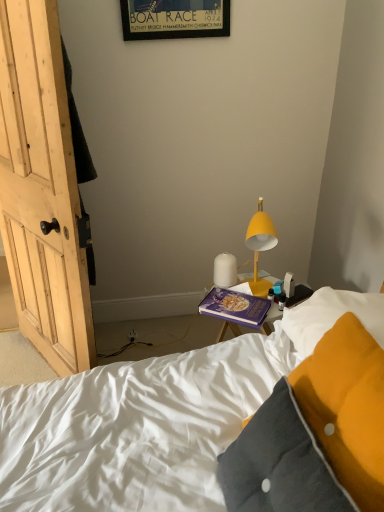
Image resolution: width=384 pixels, height=512 pixels. Identify the location of vacant point above purple matte book at center (from a real-world perspective). (238, 301).